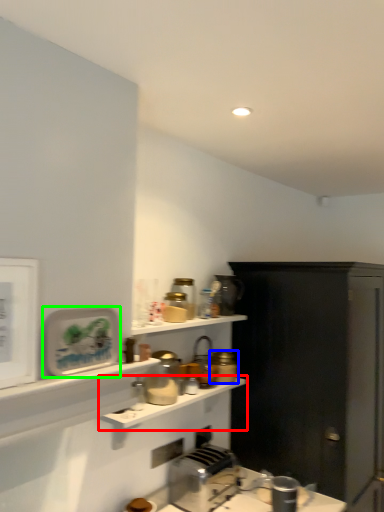
Question: Considering the real-world distances, which object is farthest from shelf (highlighted by a red box)? appliance (highlighted by a blue box) or appliance (highlighted by a green box)?

Choices:
 (A) appliance
 (B) appliance

Answer: (B)